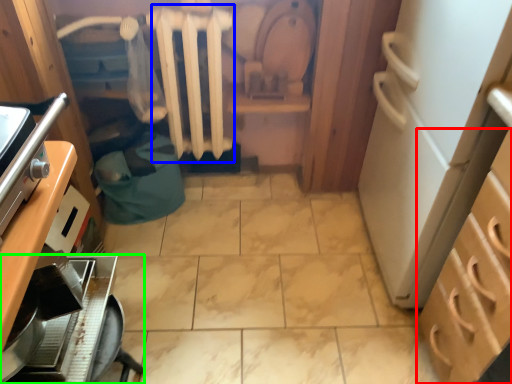
Question: Based on their relative distances, which object is farther from cabinetry (highlighted by a red box)? Choose from radiator (highlighted by a blue box) and kitchen appliance (highlighted by a green box).

Choices:
 (A) radiator
 (B) kitchen appliance

Answer: (A)